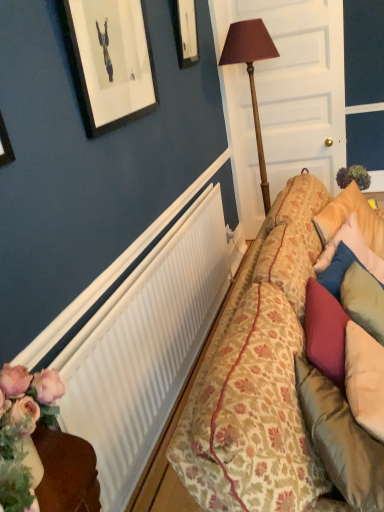
Question: Does white wood door at center appear on the left side of wooden table lamp at center?

Choices:
 (A) yes
 (B) no

Answer: (B)

Question: Considering the relative positions of white wood door at center and wooden table lamp at center in the image provided, is white wood door at center in front of wooden table lamp at center?

Choices:
 (A) no
 (B) yes

Answer: (A)

Question: Could you tell me if white wood door at center is facing wooden table lamp at center?

Choices:
 (A) yes
 (B) no

Answer: (A)

Question: Can you see white wood door at center touching wooden table lamp at center?

Choices:
 (A) no
 (B) yes

Answer: (A)

Question: From a real-world perspective, is white wood door at center physically below wooden table lamp at center?

Choices:
 (A) yes
 (B) no

Answer: (B)

Question: Does white wood door at center have a lesser width compared to wooden table lamp at center?

Choices:
 (A) yes
 (B) no

Answer: (A)

Question: Is floral-patterned fabric couch at right a part of white wood door at center?

Choices:
 (A) yes
 (B) no

Answer: (B)

Question: From a real-world perspective, is white wood door at center physically above floral-patterned fabric couch at right?

Choices:
 (A) no
 (B) yes

Answer: (B)

Question: Does white wood door at center have a lesser height compared to floral-patterned fabric couch at right?

Choices:
 (A) no
 (B) yes

Answer: (A)

Question: Is the position of white wood door at center less distant than that of floral-patterned fabric couch at right?

Choices:
 (A) no
 (B) yes

Answer: (A)

Question: Is white wood door at center aimed at floral-patterned fabric couch at right?

Choices:
 (A) no
 (B) yes

Answer: (B)

Question: Is white wood door at center looking in the opposite direction of floral-patterned fabric couch at right?

Choices:
 (A) no
 (B) yes

Answer: (A)

Question: Considering the relative sizes of wooden picture frame at upper center and white wood door at center in the image provided, is wooden picture frame at upper center taller than white wood door at center?

Choices:
 (A) no
 (B) yes

Answer: (A)